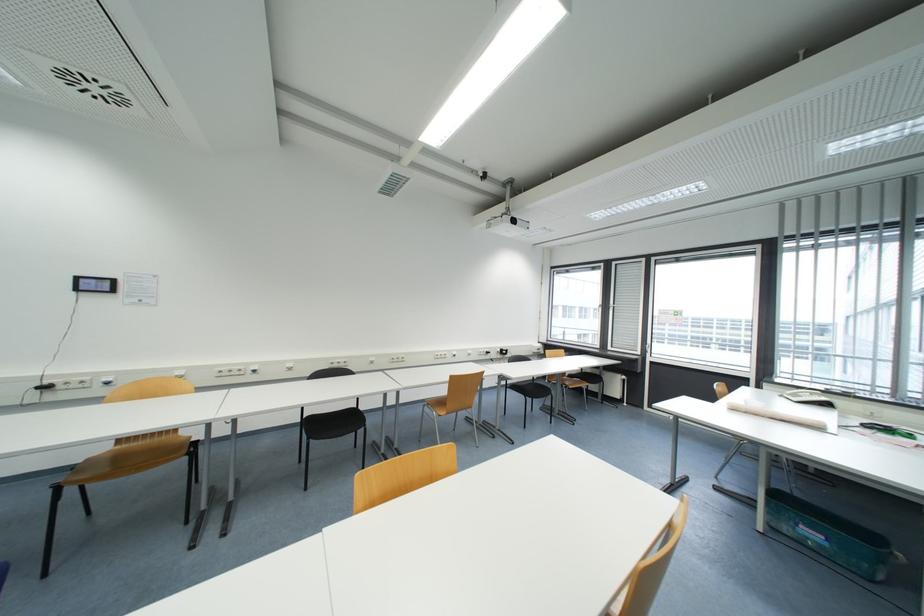
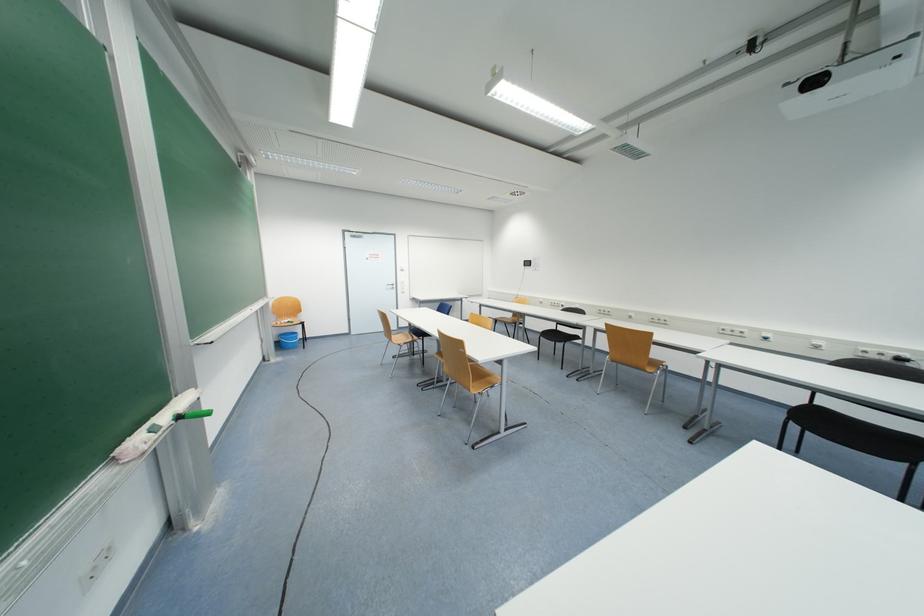
In the second image, find the point that corresponds to pixel 111 448 in the first image.

(515, 318)